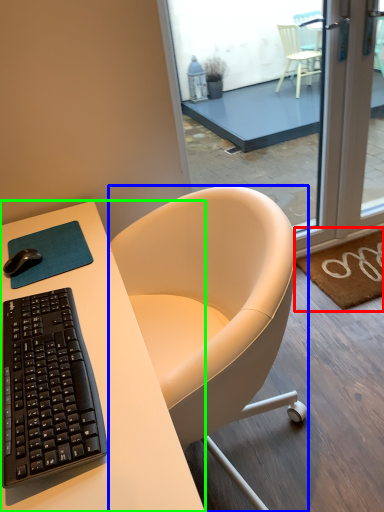
Question: Estimate the real-world distances between objects in this image. Which object is closer to doormat (highlighted by a red box), chair (highlighted by a blue box) or desk (highlighted by a green box)?

Choices:
 (A) chair
 (B) desk

Answer: (A)